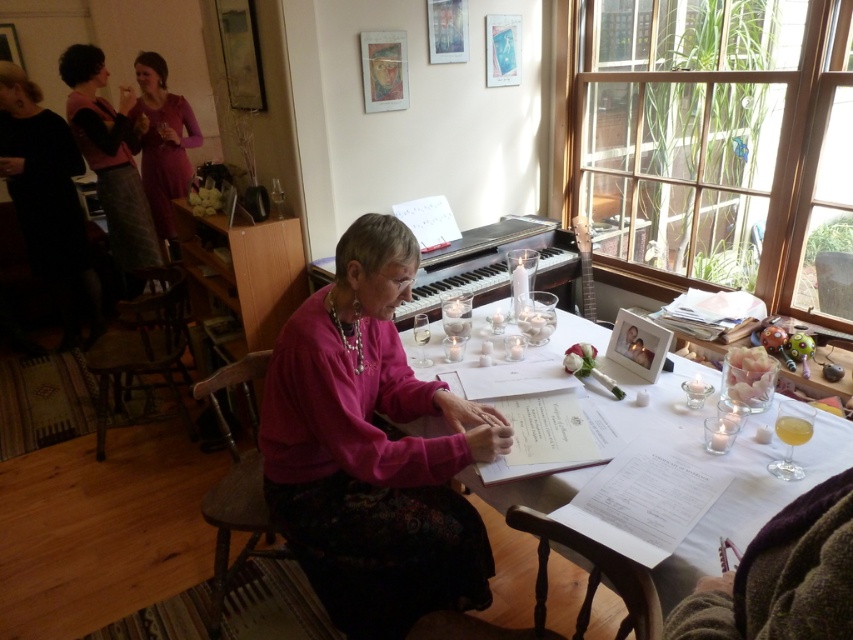
You are a guest at this gathering and want to compliment the woman on her outfit. Which item of clothing is visible first when looking at the matte pink sweater at upper left and the matte pink dress at upper left?

The matte pink sweater at upper left is visible first because it is in front of the matte pink dress at upper left.

Consider the image. You are a guest at this gathering and want to compliment the woman on her outfit. Which item of clothing is positioned lower on her body, the matte pink sweater at upper left or the matte pink dress at upper left?

The matte pink sweater at upper left is located below the matte pink dress at upper left, so the sweater is positioned lower on her body.